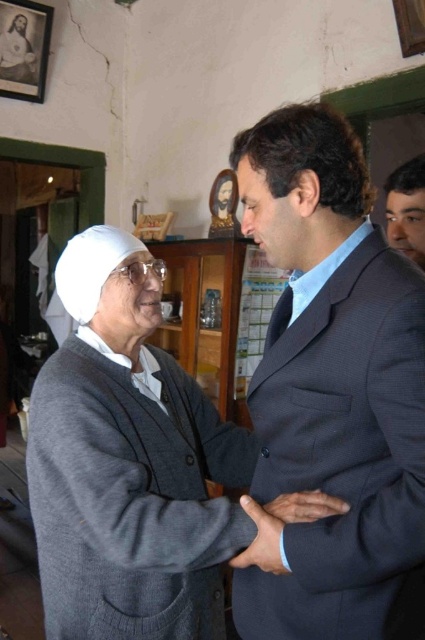
Based on the photo, you are a tailor who needs to determine which item requires more fabric for alterations between the dark blue suit at center and the blue woven tie at center. Based on their sizes, which one would need more fabric?

The dark blue suit at center is larger in size than the blue woven tie at center, so it would require more fabric for alterations.

You are a tailor measuring two dark blue suits in a fitting room. The first is labeled as dark blue suit at center and the second as dark blue textured suit at center. Which one is taller?

The dark blue suit at center is taller than the dark blue textured suit at center.

Based on the scene description, which object is positioned closer to the viewer between the dark blue suit at center and the blue woven tie at center?

The dark blue suit at center is positioned closer to the viewer than the blue woven tie at center.